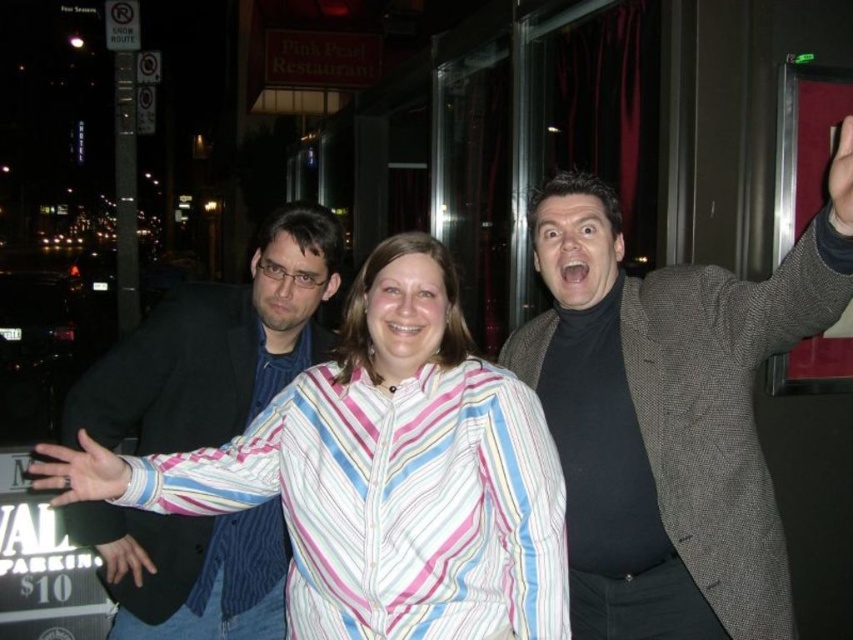
Question: Can you confirm if dark gray textured blazer at right is bigger than dark blue textured blazer at left?

Choices:
 (A) yes
 (B) no

Answer: (A)

Question: Which point is closer to the camera?

Choices:
 (A) dark gray textured blazer at right
 (B) dark blue textured blazer at left

Answer: (A)

Question: Can you confirm if dark gray textured blazer at right is bigger than dark blue textured blazer at left?

Choices:
 (A) no
 (B) yes

Answer: (B)

Question: Does dark gray textured blazer at right lie behind dark blue textured blazer at left?

Choices:
 (A) no
 (B) yes

Answer: (A)